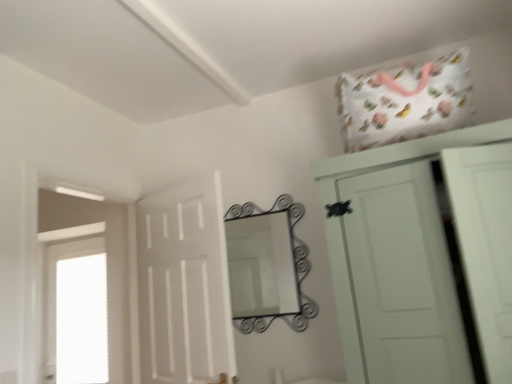
Question: From a real-world perspective, is white matte cupboard at upper right positioned under transparent glass window at left based on gravity?

Choices:
 (A) yes
 (B) no

Answer: (B)

Question: Is white matte cupboard at upper right positioned with its back to transparent glass window at left?

Choices:
 (A) yes
 (B) no

Answer: (B)

Question: From a real-world perspective, is white matte cupboard at upper right over transparent glass window at left?

Choices:
 (A) no
 (B) yes

Answer: (B)

Question: Can we say white matte cupboard at upper right lies outside transparent glass window at left?

Choices:
 (A) yes
 (B) no

Answer: (A)

Question: Considering the relative positions of white matte cupboard at upper right and transparent glass window at left in the image provided, is white matte cupboard at upper right to the left of transparent glass window at left from the viewer's perspective?

Choices:
 (A) no
 (B) yes

Answer: (A)

Question: In the image, is metallic wrought iron mirror at center positioned in front of or behind white matte door at center?

Choices:
 (A) front
 (B) behind

Answer: (B)

Question: In terms of size, does metallic wrought iron mirror at center appear bigger or smaller than white matte door at center?

Choices:
 (A) small
 (B) big

Answer: (A)

Question: Is point (239, 314) closer or farther from the camera than point (158, 208)?

Choices:
 (A) closer
 (B) farther

Answer: (B)

Question: Is metallic wrought iron mirror at center to the left or to the right of white matte door at center in the image?

Choices:
 (A) right
 (B) left

Answer: (A)

Question: From a real-world perspective, is white matte cupboard at upper right above or below metallic wrought iron mirror at center?

Choices:
 (A) above
 (B) below

Answer: (B)

Question: From the image's perspective, is white matte cupboard at upper right located above or below metallic wrought iron mirror at center?

Choices:
 (A) below
 (B) above

Answer: (B)

Question: Visually, is white matte cupboard at upper right positioned to the left or to the right of metallic wrought iron mirror at center?

Choices:
 (A) left
 (B) right

Answer: (B)

Question: Is point 326,198 positioned closer to the camera than point 291,263?

Choices:
 (A) farther
 (B) closer

Answer: (B)

Question: From the image's perspective, is white matte cupboard at upper right located above or below transparent glass window at left?

Choices:
 (A) below
 (B) above

Answer: (B)

Question: Is white matte cupboard at upper right situated inside transparent glass window at left or outside?

Choices:
 (A) outside
 (B) inside

Answer: (A)